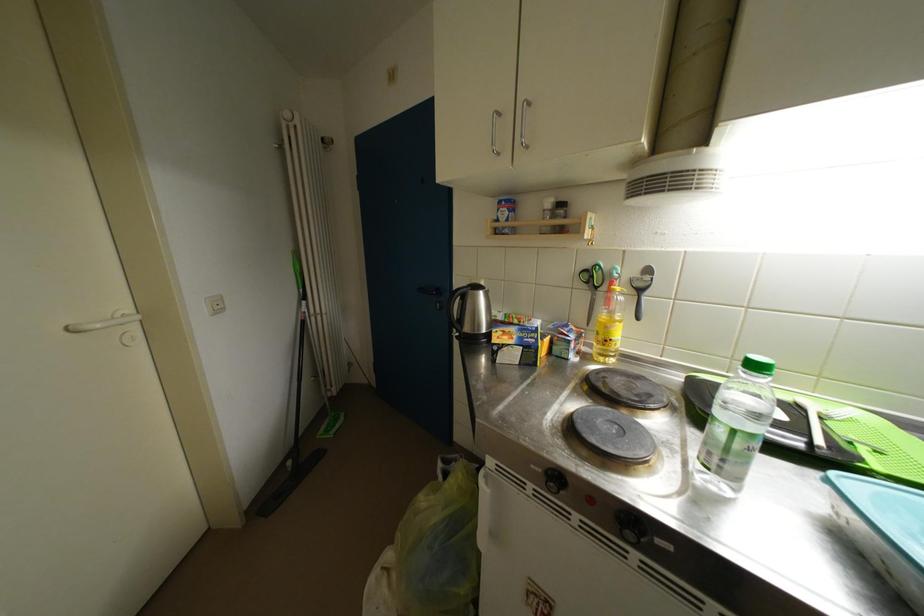
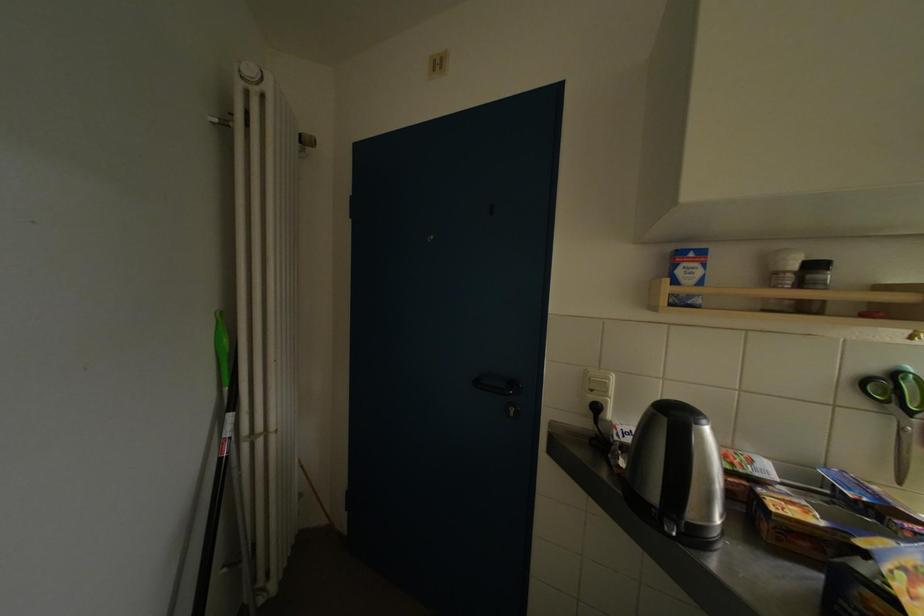
The images are taken continuously from a first-person perspective. In which direction are you moving?

The cameraman walked toward left, forward.